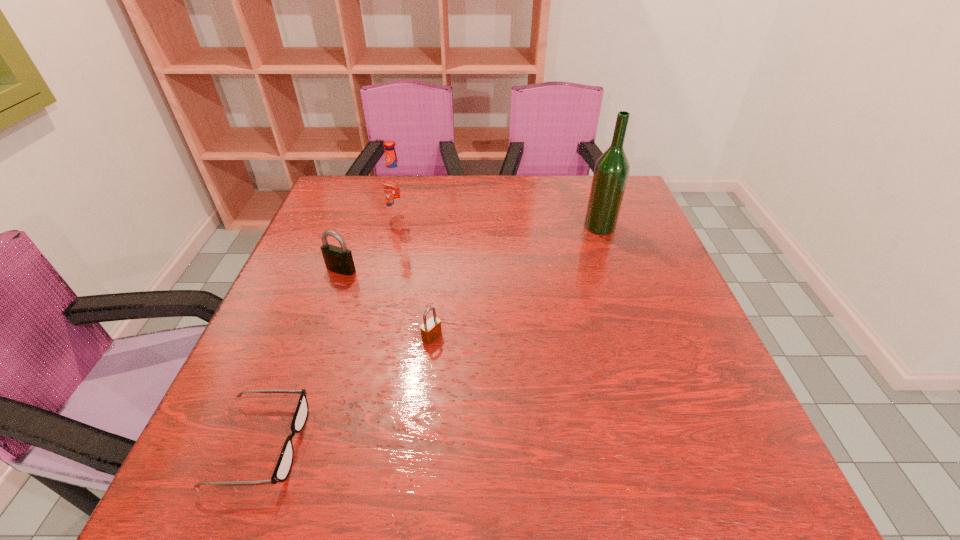
I want to click on free space located 0.200m on the front of the rightmost object, so click(x=621, y=286).

Locate an element on the screen. The height and width of the screenshot is (540, 960). free space located on the front of the fourth shortest object is located at coordinates (382, 292).

You are a GUI agent. You are given a task and a screenshot of the screen. Output one action in this format:
    pyautogui.click(x=<x>, y=<y>)
    Task: Click on the free location located 0.140m on the front of the farther padlock
    
    Given the screenshot: What is the action you would take?
    pyautogui.click(x=324, y=319)

Find the location of a particular element. This screenshot has width=960, height=540. free space located 0.320m on the left of the nearer padlock is located at coordinates (269, 336).

You are a GUI agent. You are given a task and a screenshot of the screen. Output one action in this format:
    pyautogui.click(x=<x>, y=<y>)
    Task: Click on the free location located on the front-facing side of the shortest object
    
    Given the screenshot: What is the action you would take?
    pyautogui.click(x=490, y=444)

You are a GUI agent. You are given a task and a screenshot of the screen. Output one action in this format:
    pyautogui.click(x=<x>, y=<y>)
    Task: Click on the alcohol that is at the far edge
    
    Given the screenshot: What is the action you would take?
    pyautogui.click(x=611, y=172)

You are a GUI agent. You are given a task and a screenshot of the screen. Output one action in this format:
    pyautogui.click(x=<x>, y=<y>)
    Task: Click on the root beer positioned at the far edge
    Image resolution: width=960 pixels, height=540 pixels.
    Given the screenshot: What is the action you would take?
    tap(394, 182)

At what (x,y) coordinates should I click in order to perform the action: click on object at the near edge. Please return your answer as a coordinate pair (x, y). Looking at the image, I should click on (284, 464).

The height and width of the screenshot is (540, 960). Identify the location of padlock present at the left edge. (339, 260).

At what (x,y) coordinates should I click in order to perform the action: click on spectacles that is at the left edge. Please return your answer as a coordinate pair (x, y). This screenshot has height=540, width=960. Looking at the image, I should click on (284, 464).